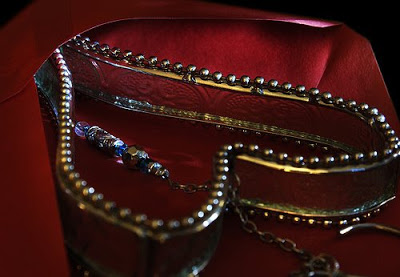
You are a GUI agent. You are given a task and a screenshot of the screen. Output one action in this format:
    pyautogui.click(x=<x>, y=<y>)
    Task: Click on the area illuminated by light
    This screenshot has height=277, width=400.
    Given the screenshot: What is the action you would take?
    pyautogui.click(x=323, y=25)